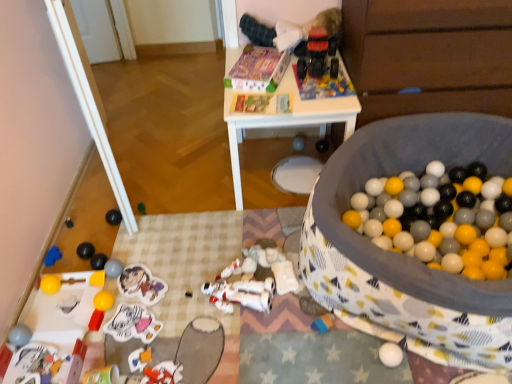
What are the coordinates of `free space that is in between yellow rubber ball at lower left, the 13th toy positioned from the right, and white matte robot at center, placed as the 7th toy when sorted from right to left` in the screenshot? It's located at (167, 300).